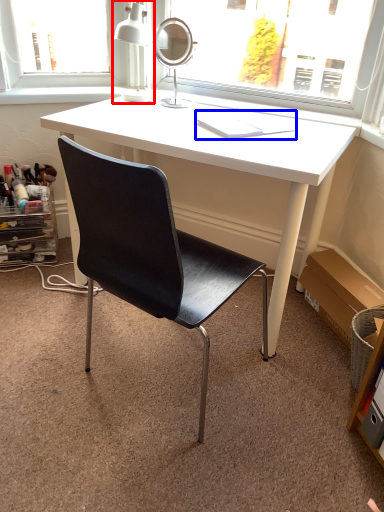
Question: Which point is further to the camera, table lamp (highlighted by a red box) or book (highlighted by a blue box)?

Choices:
 (A) table lamp
 (B) book

Answer: (A)